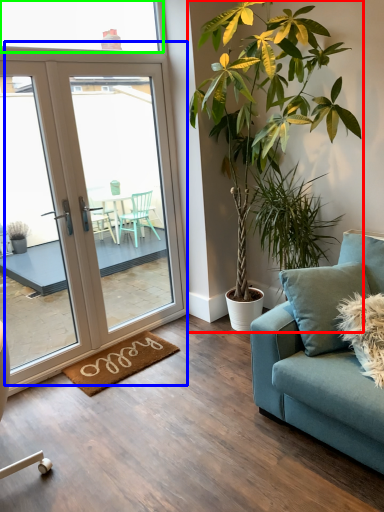
Question: Estimate the real-world distances between objects in this image. Which object is closer to houseplant (highlighted by a red box), door (highlighted by a blue box) or window (highlighted by a green box)?

Choices:
 (A) door
 (B) window

Answer: (A)